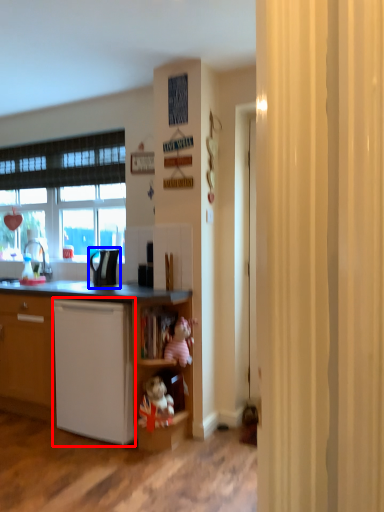
Question: Which of the following is the farthest to the observer, dish washer (highlighted by a red box) or appliance (highlighted by a blue box)?

Choices:
 (A) dish washer
 (B) appliance

Answer: (B)